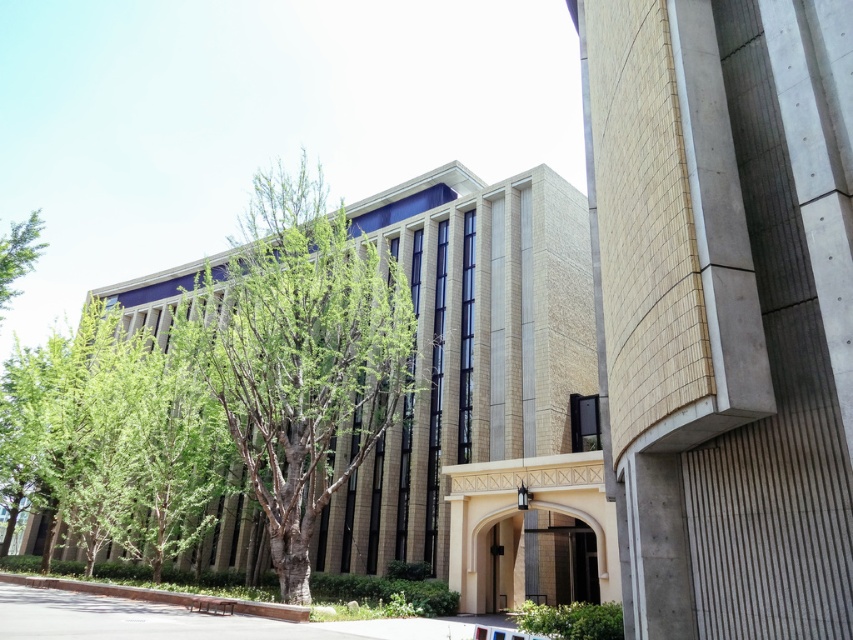
Question: Is green leafy tree at center bigger than smooth concrete pavement at lower center?

Choices:
 (A) yes
 (B) no

Answer: (A)

Question: Which point is farther to the camera?

Choices:
 (A) pos(36,212)
 (B) pos(300,554)
 (C) pos(505,628)

Answer: (A)

Question: Which object is the closest to the green leafy tree at left?

Choices:
 (A) smooth concrete pavement at lower center
 (B) green leafy tree at center
 (C) smooth wooden door at center

Answer: (B)

Question: Estimate the real-world distances between objects in this image. Which object is closer to the smooth wooden door at center?

Choices:
 (A) green leafy tree at left
 (B) green leafy tree at center

Answer: (B)

Question: Does green leafy tree at center appear over smooth wooden door at center?

Choices:
 (A) yes
 (B) no

Answer: (A)

Question: Can you confirm if smooth concrete pavement at lower center is smaller than smooth wooden door at center?

Choices:
 (A) yes
 (B) no

Answer: (B)